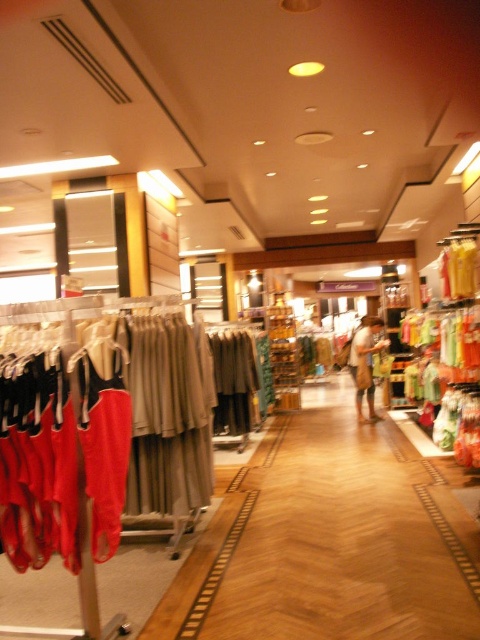
You are a store employee who needs to retrieve the matte red dress at left and the brown textured bag at center for a customer. Based on their positions in the store, which item is easier to reach without moving any other items?

The brown textured bag at center is easier to reach because the matte red dress at left is located above it, meaning the bag is lower and more accessible.

You are a customer in the retail clothing store and want to find the matte red dress at left. According to the store layout, where should you look relative to the racks with gray and beige garments?

The matte red dress at left is located closer to the front of the store compared to the racks with gray and beige garments, which are further back. Therefore, you should look near the front racks on the left side where the red and black tops are displayed.

You are a store employee who needs to retrieve the brown textured bag at center for a customer. The customer is currently standing near the matte red dress at left. Can you walk directly to the bag without moving the dress rack?

The matte red dress at left is in front of the brown textured bag at center, so you would need to move the dress rack to access the bag directly.